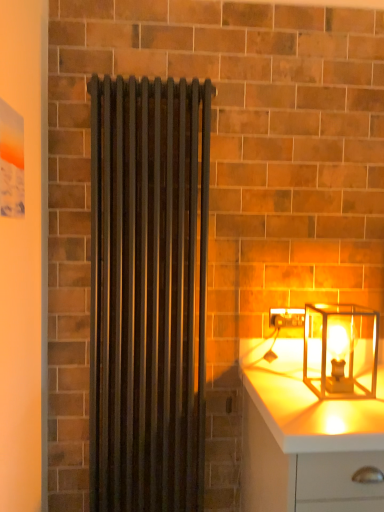
The width and height of the screenshot is (384, 512). What do you see at coordinates (148, 293) in the screenshot?
I see `matte black radiator at center` at bounding box center [148, 293].

The image size is (384, 512). Describe the element at coordinates (330, 350) in the screenshot. I see `translucent glass lantern at right` at that location.

Where is `matte black radiator at center`? matte black radiator at center is located at coordinates (148, 293).

Is point (288, 448) positioned after point (199, 170)?

That is False.

Looking at this image, from the image's perspective, would you say white glossy chest of drawers at lower right is shown under matte black radiator at center?

Yes, from the image's perspective, white glossy chest of drawers at lower right is below matte black radiator at center.

The image size is (384, 512). Identify the location of shower curtain behind the white glossy chest of drawers at lower right. (148, 293).

From the picture: From the image's perspective, does translucent glass lantern at right appear higher than matte black radiator at center?

Incorrect, from the image's perspective, translucent glass lantern at right is lower than matte black radiator at center.

Is translucent glass lantern at right outside of matte black radiator at center?

Yes, translucent glass lantern at right is located beyond the bounds of matte black radiator at center.

Looking at this image, is translucent glass lantern at right oriented away from matte black radiator at center?

That's not correct — translucent glass lantern at right is not looking away from matte black radiator at center.

Between matte black radiator at center and white glossy chest of drawers at lower right, which one has smaller width?

matte black radiator at center is thinner.

Is matte black radiator at center to the right of white glossy chest of drawers at lower right from the viewer's perspective?

No, matte black radiator at center is not to the right of white glossy chest of drawers at lower right.

Is matte black radiator at center positioned with its back to white glossy chest of drawers at lower right?

That's not correct — matte black radiator at center is not looking away from white glossy chest of drawers at lower right.

From a real-world perspective, is matte black radiator at center positioned under white glossy chest of drawers at lower right based on gravity?

Incorrect, from a real-world perspective, matte black radiator at center is higher than white glossy chest of drawers at lower right.

The height and width of the screenshot is (512, 384). Find the location of `lamp to the right of matte black radiator at center`. lamp to the right of matte black radiator at center is located at coordinates pos(330,350).

Would you say matte black radiator at center is inside or outside translucent glass lantern at right?

matte black radiator at center is not inside translucent glass lantern at right, it's outside.

How many degrees apart are the facing directions of matte black radiator at center and translucent glass lantern at right?

0.00181 degrees.

Considering their positions, is translucent glass lantern at right located in front of or behind white glossy chest of drawers at lower right?

translucent glass lantern at right is positioned farther from the viewer than white glossy chest of drawers at lower right.

Can we say translucent glass lantern at right lies outside white glossy chest of drawers at lower right?

translucent glass lantern at right lies outside white glossy chest of drawers at lower right's area.

Which of these two, translucent glass lantern at right or white glossy chest of drawers at lower right, is thinner?

Thinner between the two is translucent glass lantern at right.

From a real-world perspective, which is physically below, white glossy chest of drawers at lower right or translucent glass lantern at right?

white glossy chest of drawers at lower right, from a real-world perspective.

Is white glossy chest of drawers at lower right taller or shorter than translucent glass lantern at right?

white glossy chest of drawers at lower right is taller than translucent glass lantern at right.

Is white glossy chest of drawers at lower right spatially inside translucent glass lantern at right, or outside of it?

white glossy chest of drawers at lower right is not inside translucent glass lantern at right, it's outside.

Between white glossy chest of drawers at lower right and translucent glass lantern at right, which one is positioned in front?

white glossy chest of drawers at lower right is more forward.

Locate an element on the screen. Image resolution: width=384 pixels, height=512 pixels. shower curtain that is on the left side of white glossy chest of drawers at lower right is located at coordinates (148, 293).

This screenshot has height=512, width=384. I want to click on shower curtain that is above the translucent glass lantern at right (from a real-world perspective), so click(x=148, y=293).

From the image, which object appears to be nearer to translucent glass lantern at right, matte black radiator at center or white glossy chest of drawers at lower right?

white glossy chest of drawers at lower right lies closer to translucent glass lantern at right than the other object.

From the image, which object appears to be farther from matte black radiator at center, white glossy chest of drawers at lower right or translucent glass lantern at right?

translucent glass lantern at right.

Looking at the image, which one is located closer to white glossy chest of drawers at lower right, matte black radiator at center or translucent glass lantern at right?

Among the two, translucent glass lantern at right is located nearer to white glossy chest of drawers at lower right.

Considering their positions, is translucent glass lantern at right positioned further to white glossy chest of drawers at lower right than matte black radiator at center?

The object further to white glossy chest of drawers at lower right is matte black radiator at center.

Which object lies further to the anchor point matte black radiator at center, translucent glass lantern at right or white glossy chest of drawers at lower right?

translucent glass lantern at right lies further to matte black radiator at center than the other object.

Based on their spatial positions, is white glossy chest of drawers at lower right or matte black radiator at center further from translucent glass lantern at right?

matte black radiator at center is further to translucent glass lantern at right.

Locate an element on the screen. Image resolution: width=384 pixels, height=512 pixels. lamp between matte black radiator at center and white glossy chest of drawers at lower right is located at coordinates (330, 350).